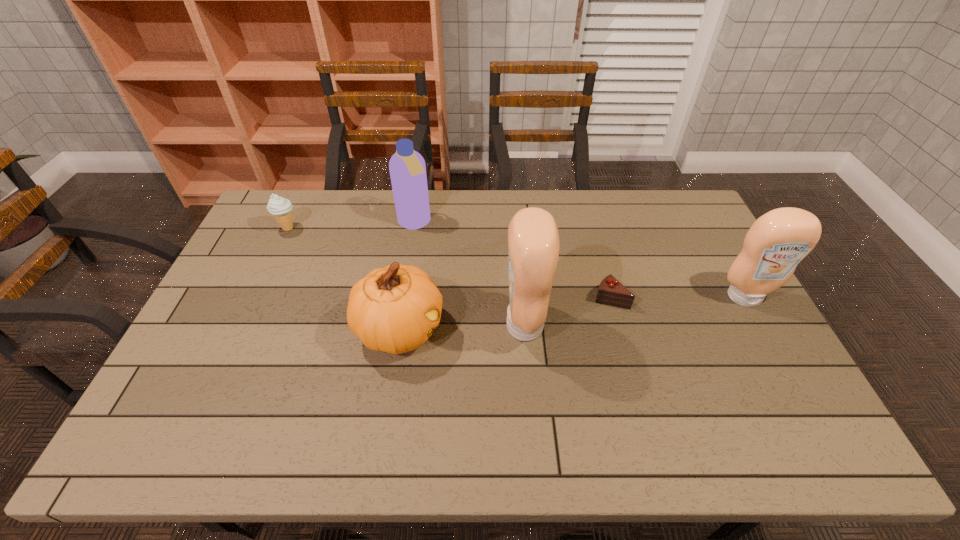
Please point a spot on the left to add another condiment. Please provide its 2D coordinates. Your answer should be formatted as a tuple, i.e. [(x, y)], where the tuple contains the x and y coordinates of a point satisfying the conditions above.

[(276, 356)]